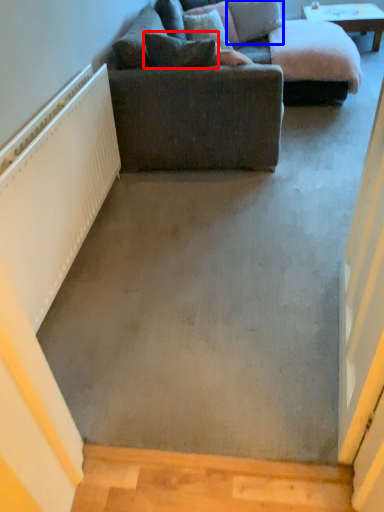
Question: Which object is further to the camera taking this photo, pillow (highlighted by a red box) or pillow (highlighted by a blue box)?

Choices:
 (A) pillow
 (B) pillow

Answer: (B)